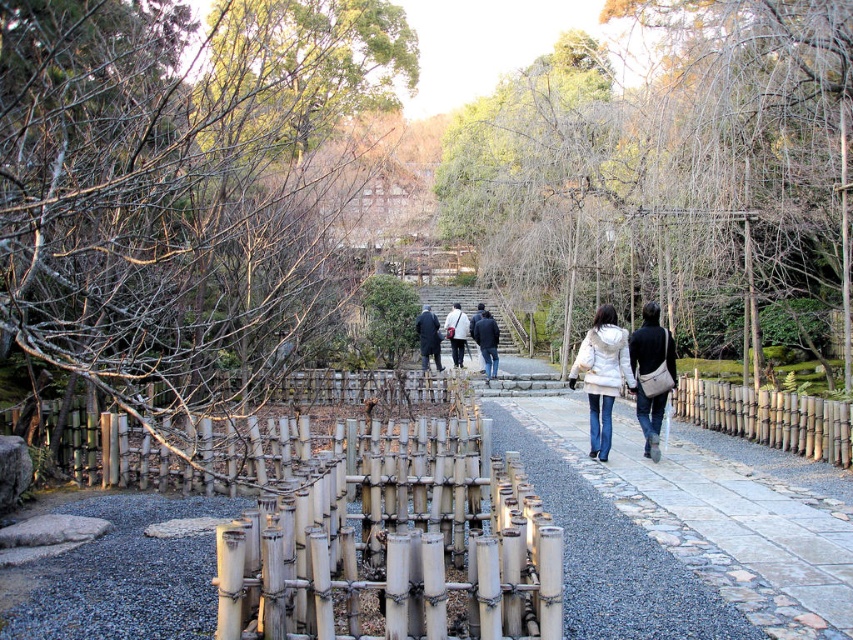
Question: Which of the following is the closest to the observer?

Choices:
 (A) smooth stone path at center
 (B) matte black jacket at center
 (C) bare branches at center
 (D) white matte jacket at center

Answer: (A)

Question: Which object appears farthest from the camera in this image?

Choices:
 (A) bare branches at center
 (B) white wool coat at center
 (C) matte black jacket at center

Answer: (B)

Question: Is smooth stone path at center bigger than white matte jacket at center?

Choices:
 (A) no
 (B) yes

Answer: (B)

Question: Can you confirm if bare branches at left is positioned to the left of bamboo fence at right?

Choices:
 (A) no
 (B) yes

Answer: (B)

Question: Can you confirm if white matte jacket at center is wider than dark blue jeans at center?

Choices:
 (A) no
 (B) yes

Answer: (B)

Question: Estimate the real-world distances between objects in this image. Which object is farther from the matte black jacket at center?

Choices:
 (A) bare branches at left
 (B) white matte jacket at center
 (C) dark blue jeans at center
 (D) smooth stone path at center

Answer: (A)